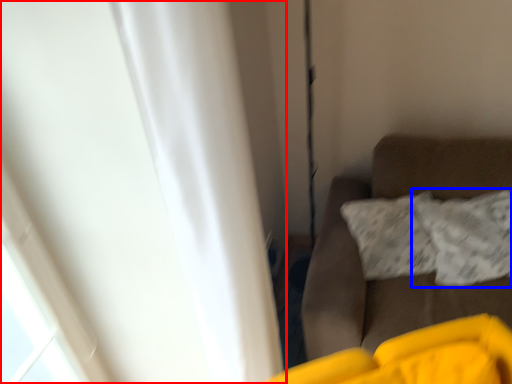
Question: Which point is further to the camera, curtain (highlighted by a red box) or pillow (highlighted by a blue box)?

Choices:
 (A) curtain
 (B) pillow

Answer: (B)